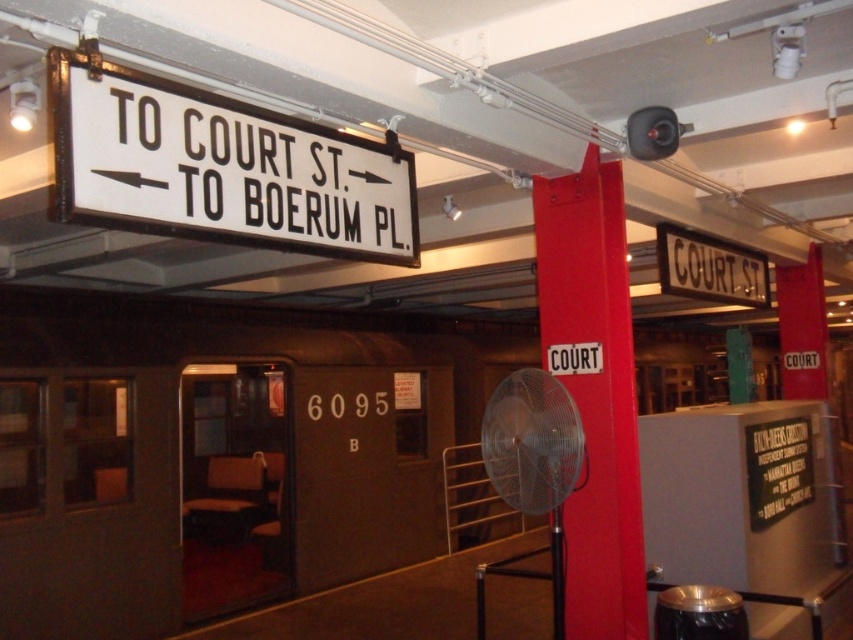
You are a maintenance worker needing to reach the white plastic sign at upper center for inspection. Your ladder can extend up to 1.5 meters. Based on the scene, can you safely reach the sign without needing additional equipment?

The distance between the white plastic sign at upper center and the camera is 1.82 meters, which exceeds the ladder extension limit of 1.5 meters. Therefore, you cannot safely reach the sign without additional equipment.

In the scene shown: You are a visitor at the museum exhibit and want to know which sign is bigger between the white plastic sign at upper center and the red matte signpost at center. Can you tell me?

The white plastic sign at upper center has a larger size compared to the red matte signpost at center, so the white plastic sign at upper center is bigger.